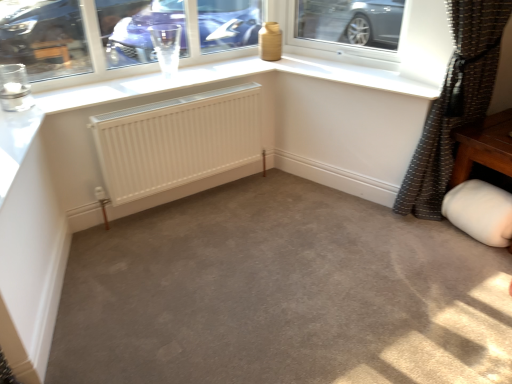
Question: Looking at their shapes, would you say brown textured curtain at right is wider or thinner than white matte jar at lower right?

Choices:
 (A) thin
 (B) wide

Answer: (B)

Question: From a real-world perspective, is brown textured curtain at right above or below white matte jar at lower right?

Choices:
 (A) below
 (B) above

Answer: (B)

Question: Estimate the real-world distances between objects in this image. Which object is closer to the brown textured curtain at right?

Choices:
 (A) transparent glass at upper center
 (B) white matte jar at lower right
 (C) white matte radiator at center

Answer: (B)

Question: Based on their relative distances, which object is farther from the white matte radiator at center?

Choices:
 (A) transparent glass at upper center
 (B) brown textured curtain at right
 (C) white matte jar at lower right

Answer: (C)